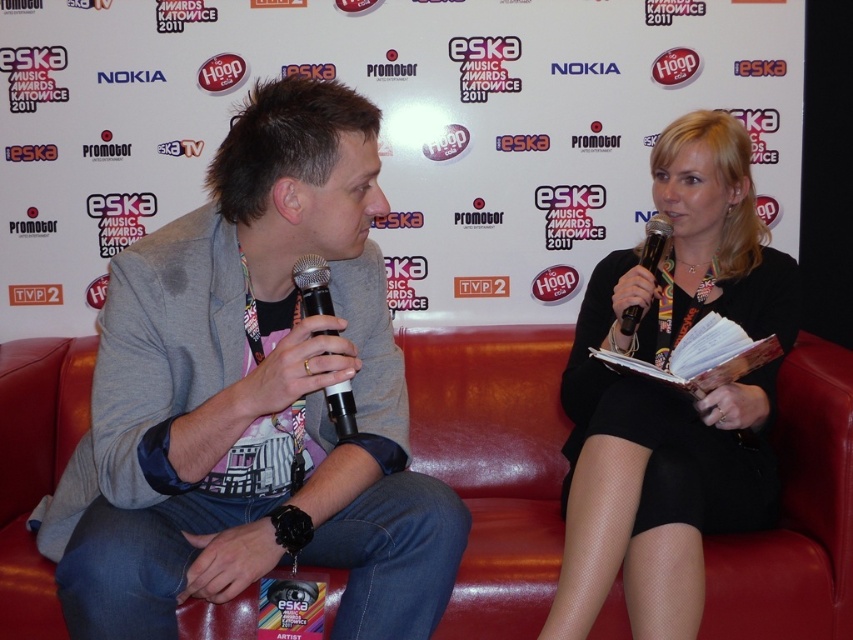
Between point (325, 266) and point (633, 314), which one is positioned behind?

Positioned behind is point (633, 314).

Consider the image. Does black metallic microphone at center appear under black plastic microphone at upper right?

Correct, black metallic microphone at center is located below black plastic microphone at upper right.

This screenshot has height=640, width=853. Identify the location of black metallic microphone at center. (312, 285).

Where is `black metallic microphone at center`? black metallic microphone at center is located at coordinates (312, 285).

Does point (12, 480) come in front of point (351, 408)?

No, (12, 480) is behind (351, 408).

Is leather at center to the right of black metallic microphone at center from the viewer's perspective?

Indeed, leather at center is positioned on the right side of black metallic microphone at center.

Does point (519, 426) come behind point (328, 305)?

Yes.

The image size is (853, 640). I want to click on leather at center, so click(x=494, y=465).

Is gray fabric jacket at left wider than black fabric dress at center?

Yes.

Is gray fabric jacket at left bigger than black fabric dress at center?

Yes.

What do you see at coordinates (253, 400) in the screenshot? I see `gray fabric jacket at left` at bounding box center [253, 400].

Locate an element on the screen. The width and height of the screenshot is (853, 640). gray fabric jacket at left is located at coordinates (253, 400).